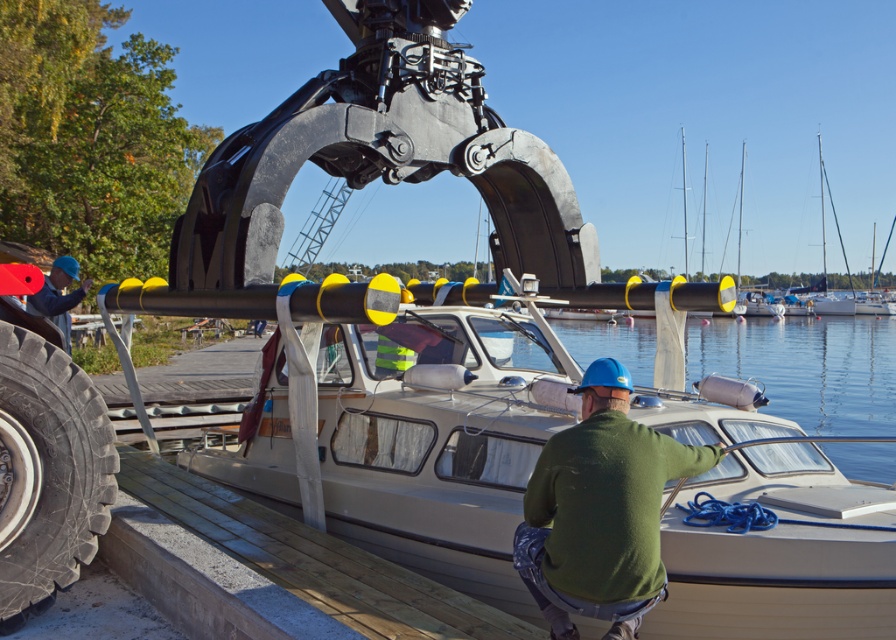
Question: Based on their relative distances, which object is nearer to the white plastic boat at center?

Choices:
 (A) clear water at boat right
 (B) black rubber tire at lower left

Answer: (B)

Question: Can you confirm if white plastic boat at center is bigger than green matte shirt at center?

Choices:
 (A) yes
 (B) no

Answer: (A)

Question: Is the position of black rubber tire at lower left more distant than that of clear water at boat right?

Choices:
 (A) no
 (B) yes

Answer: (A)

Question: Considering the relative positions of white plastic boat at center and clear water at boat right in the image provided, where is white plastic boat at center located with respect to clear water at boat right?

Choices:
 (A) right
 (B) left

Answer: (B)

Question: Which of the following is the farthest from the observer?

Choices:
 (A) (289, 456)
 (B) (771, 369)
 (C) (531, 481)
 (D) (52, 348)

Answer: (B)

Question: Which point appears farthest from the camera in this image?

Choices:
 (A) (16, 353)
 (B) (619, 381)

Answer: (A)